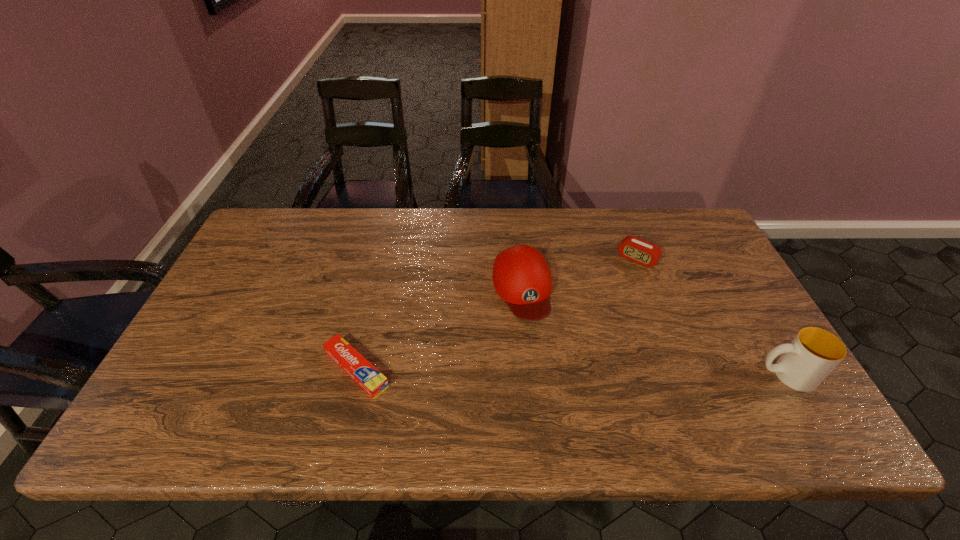
You are a GUI agent. You are given a task and a screenshot of the screen. Output one action in this format:
    pyautogui.click(x=<x>, y=<y>)
    Task: Click on the vacant space situated on the front-facing side of the third tallest object
    
    Given the screenshot: What is the action you would take?
    point(621,279)

Where is `blank area located on the front-facing side of the third tallest object`? blank area located on the front-facing side of the third tallest object is located at coordinates (600, 307).

Where is `vacant region located on the front-facing side of the third tallest object`? The width and height of the screenshot is (960, 540). vacant region located on the front-facing side of the third tallest object is located at coordinates (612, 291).

The image size is (960, 540). I want to click on vacant space located 0.150m on the front-facing side of the baseball cap, so click(x=548, y=370).

At what (x,y) coordinates should I click in order to perform the action: click on free space located on the front-facing side of the baseball cap. Please return your answer as a coordinate pair (x, y). Looking at the image, I should click on (540, 347).

The width and height of the screenshot is (960, 540). Find the location of `blank space located 0.150m on the front-facing side of the baseball cap`. blank space located 0.150m on the front-facing side of the baseball cap is located at coordinates [x=548, y=370].

You are a GUI agent. You are given a task and a screenshot of the screen. Output one action in this format:
    pyautogui.click(x=<x>, y=<y>)
    Task: Click on the object at the far edge
    The height and width of the screenshot is (540, 960).
    Given the screenshot: What is the action you would take?
    pyautogui.click(x=635, y=249)

Locate an element on the screen. The height and width of the screenshot is (540, 960). toothpaste that is at the near edge is located at coordinates (x=351, y=361).

Find the location of a particular element. cup that is positioned at the near edge is located at coordinates (813, 354).

Find the location of a particular element. The width and height of the screenshot is (960, 540). object positioned at the right edge is located at coordinates (813, 354).